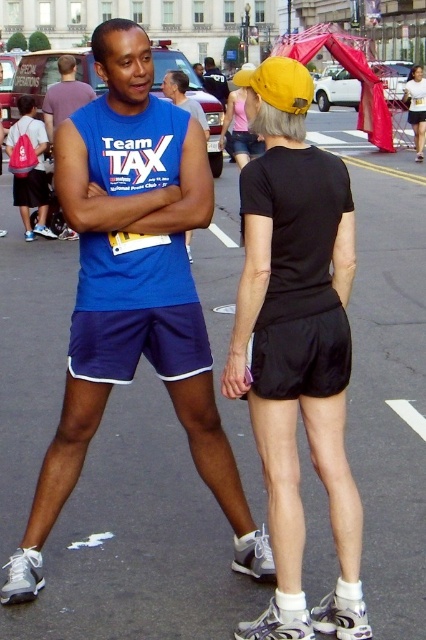
Question: Which point is farther to the camera?

Choices:
 (A) (74, 129)
 (B) (57, 84)

Answer: (B)

Question: Which point is farther to the camera?

Choices:
 (A) (281, 225)
 (B) (74, 70)

Answer: (B)

Question: Does blue sleeveless shirt at left have a smaller size compared to matte black shorts at center?

Choices:
 (A) yes
 (B) no

Answer: (A)

Question: Is blue sleeveless shirt at left bigger than blue sleeveless shirt at center?

Choices:
 (A) yes
 (B) no

Answer: (A)

Question: Considering the real-world distances, which object is farthest from the blue sleeveless shirt at left?

Choices:
 (A) matte black shorts at center
 (B) blue sleeveless shirt at center

Answer: (A)

Question: Is black matte shorts at center wider than blue sleeveless shirt at center?

Choices:
 (A) yes
 (B) no

Answer: (A)